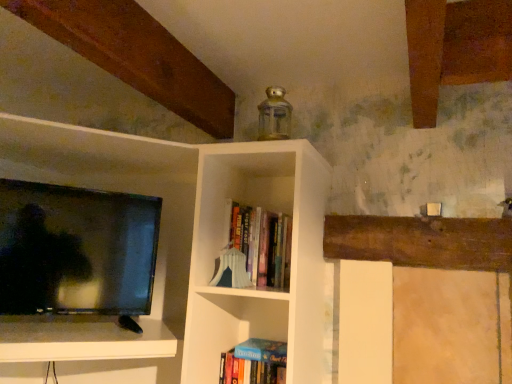
Question: Is hardcover books at center, the 2th book when ordered from bottom to top, further to the viewer compared to hardcover book at lower center, arranged as the 1th book when ordered from the bottom?

Choices:
 (A) yes
 (B) no

Answer: (B)

Question: Is hardcover books at center, the 2th book when ordered from bottom to top, with hardcover book at lower center, arranged as the 1th book when ordered from the bottom?

Choices:
 (A) yes
 (B) no

Answer: (B)

Question: From a real-world perspective, is hardcover books at center, which is the first book from top to bottom, on top of hardcover book at lower center, which ranks as the 2th book in top-to-bottom order?

Choices:
 (A) no
 (B) yes

Answer: (B)

Question: From a real-world perspective, is hardcover books at center, the 2th book when ordered from bottom to top, physically below hardcover book at lower center, arranged as the 1th book when ordered from the bottom?

Choices:
 (A) yes
 (B) no

Answer: (B)

Question: Can you confirm if hardcover books at center, the 2th book when ordered from bottom to top, is positioned to the right of hardcover book at lower center, arranged as the 1th book when ordered from the bottom?

Choices:
 (A) no
 (B) yes

Answer: (B)

Question: Considering the relative sizes of hardcover books at center, which is the first book from top to bottom, and hardcover book at lower center, arranged as the 1th book when ordered from the bottom, in the image provided, is hardcover books at center, which is the first book from top to bottom, taller than hardcover book at lower center, arranged as the 1th book when ordered from the bottom,?

Choices:
 (A) no
 (B) yes

Answer: (B)

Question: From the image's perspective, does hardcover book at lower center, which ranks as the 2th book in top-to-bottom order, appear lower than hardcover books at center, the 2th book when ordered from bottom to top?

Choices:
 (A) yes
 (B) no

Answer: (A)

Question: Does hardcover book at lower center, arranged as the 1th book when ordered from the bottom, have a greater height compared to hardcover books at center, the 2th book when ordered from bottom to top?

Choices:
 (A) no
 (B) yes

Answer: (A)

Question: Is hardcover book at lower center, which ranks as the 2th book in top-to-bottom order, far away from hardcover books at center, the 2th book when ordered from bottom to top?

Choices:
 (A) yes
 (B) no

Answer: (B)

Question: From the image's perspective, would you say hardcover book at lower center, which ranks as the 2th book in top-to-bottom order, is positioned over hardcover books at center, the 2th book when ordered from bottom to top?

Choices:
 (A) yes
 (B) no

Answer: (B)

Question: Is hardcover book at lower center, which ranks as the 2th book in top-to-bottom order, bigger than hardcover books at center, which is the first book from top to bottom?

Choices:
 (A) yes
 (B) no

Answer: (B)

Question: Is hardcover book at lower center, which ranks as the 2th book in top-to-bottom order, positioned in front of hardcover books at center, the 2th book when ordered from bottom to top?

Choices:
 (A) no
 (B) yes

Answer: (A)

Question: Is hardcover books at center, the 2th book when ordered from bottom to top, taller or shorter than hardcover book at lower center, which ranks as the 2th book in top-to-bottom order?

Choices:
 (A) short
 (B) tall

Answer: (B)